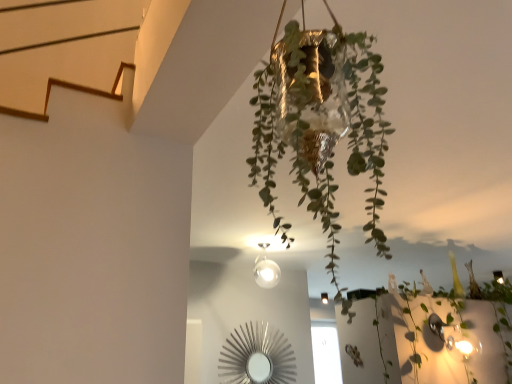
Question: Is green leafy plant at center directly adjacent to matte white glass light fixture at center?

Choices:
 (A) no
 (B) yes

Answer: (A)

Question: Considering the relative sizes of green leafy plant at center and matte white glass light fixture at center in the image provided, is green leafy plant at center thinner than matte white glass light fixture at center?

Choices:
 (A) yes
 (B) no

Answer: (B)

Question: Is matte white glass light fixture at center completely or partially inside green leafy plant at center?

Choices:
 (A) no
 (B) yes

Answer: (A)

Question: From the image's perspective, is green leafy plant at center beneath matte white glass light fixture at center?

Choices:
 (A) no
 (B) yes

Answer: (A)

Question: Is green leafy plant at center not near matte white glass light fixture at center?

Choices:
 (A) yes
 (B) no

Answer: (A)

Question: Is gold foil pot at center situated inside matte white glass light fixture at center or outside?

Choices:
 (A) inside
 (B) outside

Answer: (B)

Question: Looking at the image, does gold foil pot at center seem bigger or smaller compared to matte white glass light fixture at center?

Choices:
 (A) small
 (B) big

Answer: (B)

Question: Does point (335, 33) appear closer or farther from the camera than point (324, 294)?

Choices:
 (A) closer
 (B) farther

Answer: (A)

Question: In terms of width, does gold foil pot at center look wider or thinner when compared to matte white glass light fixture at center?

Choices:
 (A) wide
 (B) thin

Answer: (A)

Question: Is point coord(300,102) closer or farther from the camera than point coord(378,309)?

Choices:
 (A) closer
 (B) farther

Answer: (A)

Question: In terms of width, does gold foil pot at center look wider or thinner when compared to green leafy plant at center?

Choices:
 (A) wide
 (B) thin

Answer: (B)

Question: From a real-world perspective, relative to green leafy plant at center, is gold foil pot at center vertically above or below?

Choices:
 (A) above
 (B) below

Answer: (A)

Question: Is gold foil pot at center taller or shorter than green leafy plant at center?

Choices:
 (A) short
 (B) tall

Answer: (B)

Question: From the image's perspective, is green leafy plant at center positioned above or below gold foil pot at center?

Choices:
 (A) above
 (B) below

Answer: (B)

Question: Considering the positions of point (413, 372) and point (316, 69), is point (413, 372) closer or farther from the camera than point (316, 69)?

Choices:
 (A) farther
 (B) closer

Answer: (A)